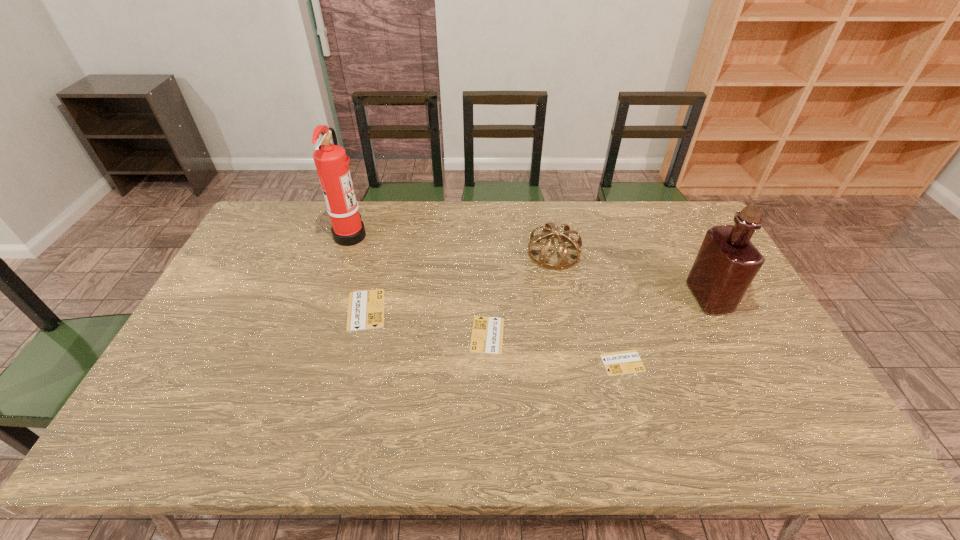
In order to click on vacant position in the image that satisfies the following two spatial constraints: 1. at the nozzle of the leftmost object; 2. on the back side of the rightmost object in this screenshot , I will do `click(329, 297)`.

Locate an element on the screen. Image resolution: width=960 pixels, height=540 pixels. vacant space that satisfies the following two spatial constraints: 1. at the nozzle of the fire extinguisher; 2. on the right side of the liquor is located at coordinates point(329,297).

Image resolution: width=960 pixels, height=540 pixels. What are the coordinates of `vacant point that satisfies the following two spatial constraints: 1. at the nozzle of the leftmost identity card; 2. on the right side of the fire extinguisher` in the screenshot? It's located at (325, 310).